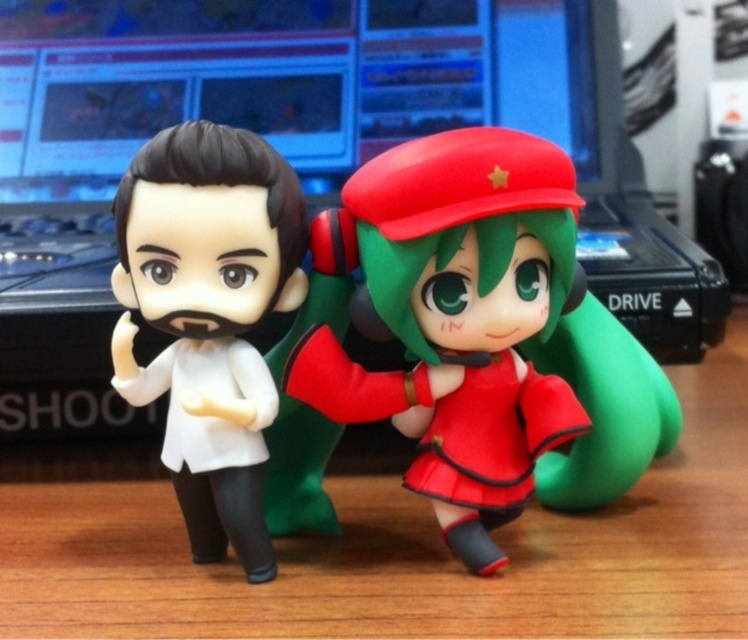
You are organizing a desk and need to place a new item between the wooden table at center and the white matte figure at left. Based on their positions, which object should the new item be closer to?

The new item should be closer to the white matte figure at left because the wooden table at center is to the right of the white matte figure at left, meaning there is less space between them on the left side.

You are organizing a desk space and need to place both the wooden table at center and the rubberized red figure at center. Based on their positions in the image, which object is located below the other?

The wooden table at center is positioned under the rubberized red figure at center, so the wooden table at center is below the rubberized red figure at center.

You are standing in front of a desk with a wooden table at center. You want to place a 12 inch tall coffee mug on the table. Will the mug fit on the table?

The wooden table at center is 32.17 inches away from you, but the distance does not affect the mug placement. The question about the mug fitting depends on the table size, which is not provided in the description.